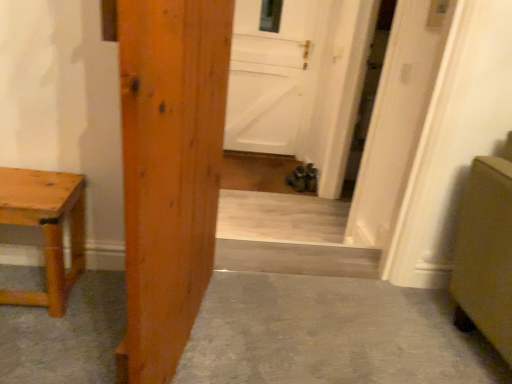
Question: Is wooden door at center, acting as the first door starting from the left, at the left side of natural wood table at left?

Choices:
 (A) no
 (B) yes

Answer: (A)

Question: Could you tell me if wooden door at center, acting as the first door starting from the left, is turned towards natural wood table at left?

Choices:
 (A) yes
 (B) no

Answer: (B)

Question: Can you confirm if wooden door at center, marked as the third door in a right-to-left arrangement, is wider than natural wood table at left?

Choices:
 (A) yes
 (B) no

Answer: (B)

Question: From a real-world perspective, is wooden door at center, which appears as the 3th door when viewed from the back, on natural wood table at left?

Choices:
 (A) yes
 (B) no

Answer: (A)

Question: Is wooden door at center, which appears as the 3th door when viewed from the back, taller than natural wood table at left?

Choices:
 (A) yes
 (B) no

Answer: (A)

Question: Considering the positions of smooth concrete floor at center and white matte door at center, marked as the 2th door in a front-to-back arrangement, in the image, is smooth concrete floor at center wider or thinner than white matte door at center, marked as the 2th door in a front-to-back arrangement,?

Choices:
 (A) wide
 (B) thin

Answer: (A)

Question: From a real-world perspective, is smooth concrete floor at center physically located above or below white matte door at center, the 2th door from the back?

Choices:
 (A) below
 (B) above

Answer: (A)

Question: From the image's perspective, is smooth concrete floor at center located above or below white matte door at center, the 3th door viewed from the left?

Choices:
 (A) above
 (B) below

Answer: (B)

Question: Is smooth concrete floor at center taller or shorter than white matte door at center, placed as the 1th door when sorted from right to left?

Choices:
 (A) tall
 (B) short

Answer: (B)

Question: Is white matte door at center, which is the 2th door from left to right, taller or shorter than natural wood table at left?

Choices:
 (A) tall
 (B) short

Answer: (A)

Question: Is white matte door at center, which is the 2th door in right-to-left order, in front of or behind natural wood table at left in the image?

Choices:
 (A) front
 (B) behind

Answer: (B)

Question: From the image's perspective, is white matte door at center, placed as the third door when sorted from front to back, positioned above or below natural wood table at left?

Choices:
 (A) above
 (B) below

Answer: (A)

Question: Looking at the image, does white matte door at center, marked as the first door in a back-to-front arrangement, seem bigger or smaller compared to natural wood table at left?

Choices:
 (A) small
 (B) big

Answer: (B)

Question: Is point (192, 319) closer or farther from the camera than point (401, 140)?

Choices:
 (A) farther
 (B) closer

Answer: (B)

Question: Is wooden door at center, acting as the first door starting from the left, inside the boundaries of white matte door at center, the 2th door from the back, or outside?

Choices:
 (A) inside
 (B) outside

Answer: (B)